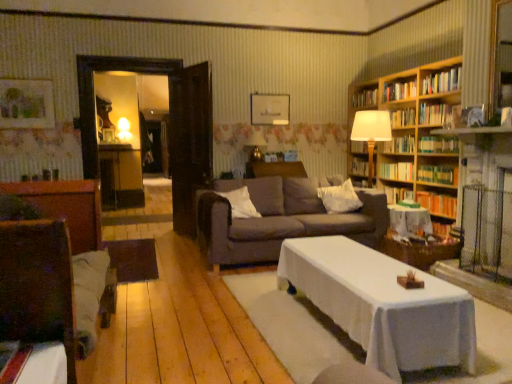
Question: From the image's perspective, is matte white picture frame at upper center located above hardcover book at center, placed as the second book when sorted from bottom to top?

Choices:
 (A) no
 (B) yes

Answer: (B)

Question: Is matte white picture frame at upper center shorter than hardcover book at center, placed as the second book when sorted from bottom to top?

Choices:
 (A) no
 (B) yes

Answer: (A)

Question: Is matte white picture frame at upper center positioned far away from hardcover book at center, placed as the second book when sorted from bottom to top?

Choices:
 (A) no
 (B) yes

Answer: (B)

Question: Is matte white picture frame at upper center looking in the opposite direction of hardcover book at center, arranged as the 10th book when viewed from the top?

Choices:
 (A) yes
 (B) no

Answer: (B)

Question: Is hardcover book at center, placed as the second book when sorted from bottom to top, located within matte white picture frame at upper center?

Choices:
 (A) yes
 (B) no

Answer: (B)

Question: Considering the relative positions of matte white picture frame at upper center and hardcover book at center, arranged as the 10th book when viewed from the top, in the image provided, is matte white picture frame at upper center in front of hardcover book at center, arranged as the 10th book when viewed from the top,?

Choices:
 (A) no
 (B) yes

Answer: (A)

Question: Considering the relative sizes of hardcover books at upper right, the tenth book from the bottom, and hardcover book at upper right, the sixth book when ordered from top to bottom, in the image provided, is hardcover books at upper right, the tenth book from the bottom, bigger than hardcover book at upper right, the sixth book when ordered from top to bottom,?

Choices:
 (A) yes
 (B) no

Answer: (A)

Question: Can you confirm if hardcover books at upper right, the 2th book viewed from the top, is thinner than hardcover book at upper right, which appears as the 6th book when ordered from the bottom?

Choices:
 (A) yes
 (B) no

Answer: (A)

Question: Is hardcover books at upper right, the 2th book viewed from the top, positioned beyond the bounds of hardcover book at upper right, the sixth book when ordered from top to bottom?

Choices:
 (A) no
 (B) yes

Answer: (B)

Question: Is hardcover books at upper right, the tenth book from the bottom, behind hardcover book at upper right, the sixth book when ordered from top to bottom?

Choices:
 (A) no
 (B) yes

Answer: (A)

Question: Is hardcover books at upper right, the 2th book viewed from the top, to the left of hardcover book at upper right, the sixth book when ordered from top to bottom, from the viewer's perspective?

Choices:
 (A) yes
 (B) no

Answer: (A)

Question: From the image's perspective, is hardcover books at upper right, the tenth book from the bottom, under hardcover book at upper right, which appears as the 6th book when ordered from the bottom?

Choices:
 (A) yes
 (B) no

Answer: (B)

Question: From a real-world perspective, is white soft pillow at center, marked as the 1th pillow in a left-to-right arrangement, below hardcover book at upper right, the seventh book positioned from the bottom?

Choices:
 (A) yes
 (B) no

Answer: (A)